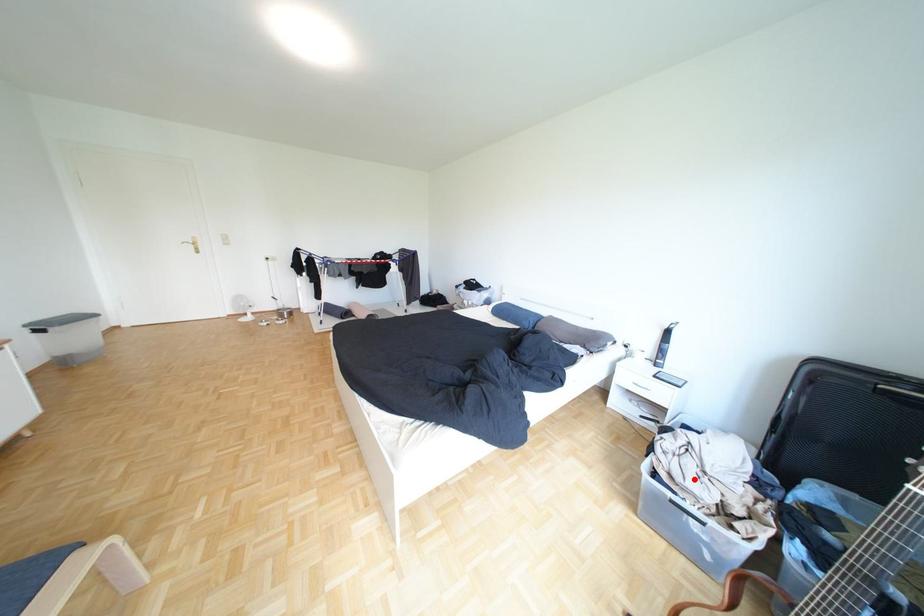
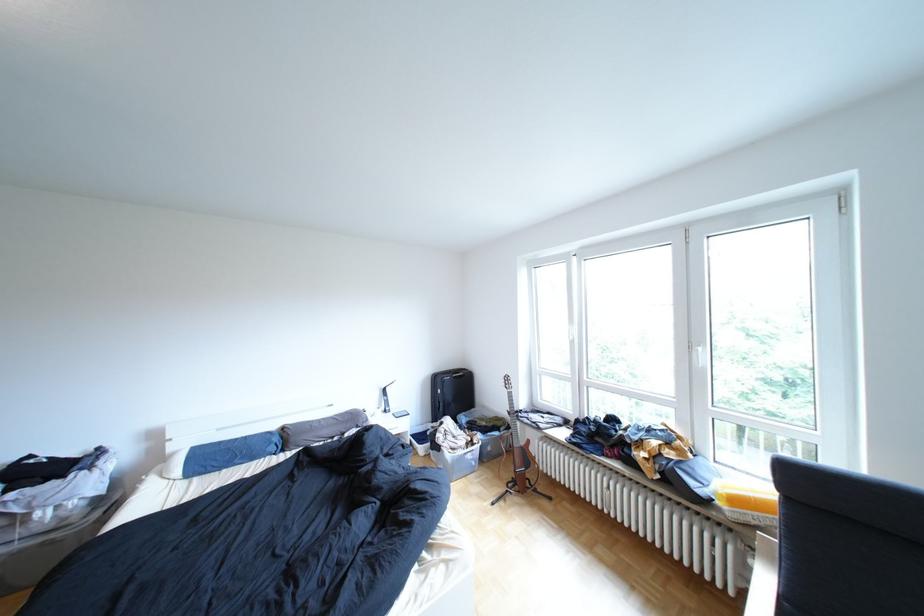
Where in the second image is the point corresponding to the highlighted location from the first image?

(470, 446)